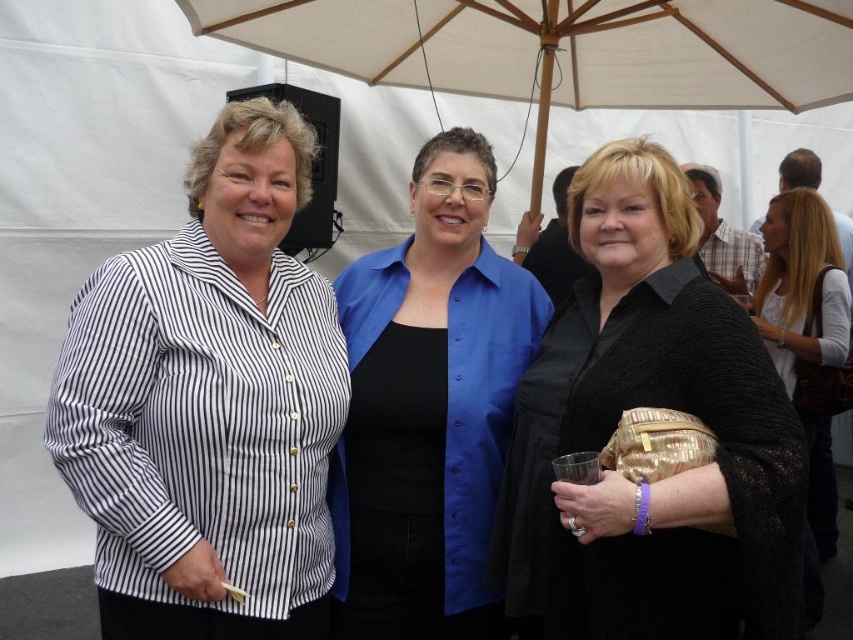
Question: Can you confirm if black textured sweater at center is positioned to the left of blue satin blouse at center?

Choices:
 (A) yes
 (B) no

Answer: (B)

Question: Estimate the real-world distances between objects in this image. Which object is closer to the white fabric umbrella at upper center?

Choices:
 (A) blonde hair at upper right
 (B) white striped shirt at center

Answer: (A)

Question: Is white striped shirt at center wider than blue satin blouse at center?

Choices:
 (A) yes
 (B) no

Answer: (B)

Question: Is blue satin blouse at center thinner than blonde hair at upper right?

Choices:
 (A) no
 (B) yes

Answer: (B)

Question: Which is nearer to the white fabric umbrella at upper center?

Choices:
 (A) white striped shirt at center
 (B) black textured sweater at center

Answer: (A)

Question: Which of the following is the closest to the observer?

Choices:
 (A) blonde hair at upper right
 (B) black textured sweater at center
 (C) white striped shirt at center

Answer: (B)